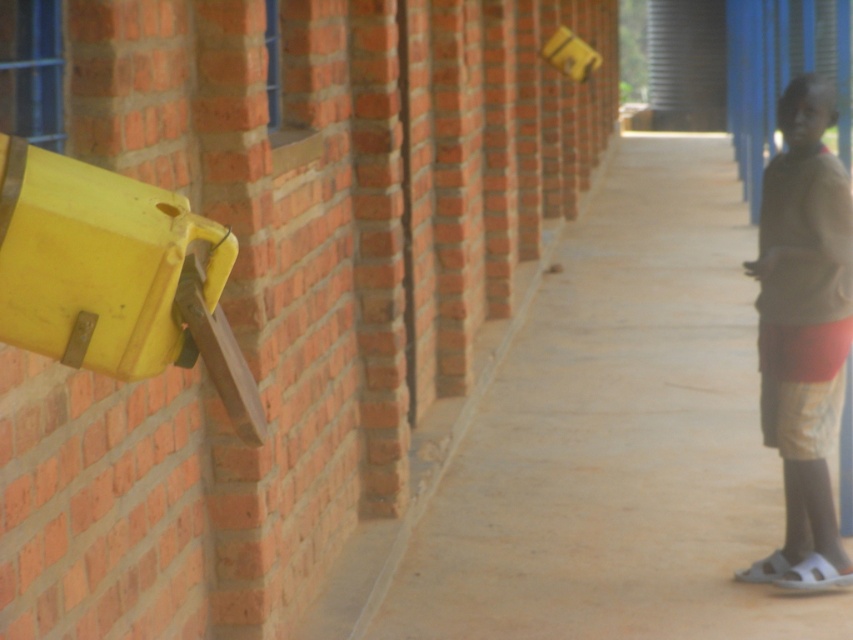
Looking at this image, you are standing in the corridor and notice the smooth concrete pavement at center and the brown cotton shirt at right. Which object is higher in elevation?

The smooth concrete pavement at center has a greater height compared to the brown cotton shirt at right, so the smooth concrete pavement at center is higher in elevation.

You are standing in the corridor and see the smooth concrete pavement at center and the brown cotton shirt at right. Which object is positioned to the left of the other?

The smooth concrete pavement at center is to the right of the brown cotton shirt at right, so the brown cotton shirt at right is positioned to the left of the smooth concrete pavement at center.